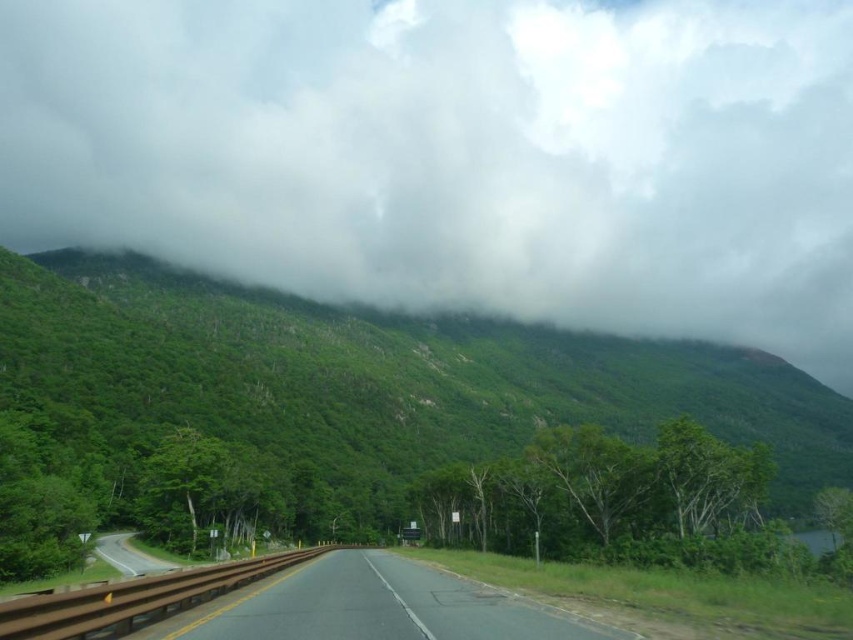
You are a driver approaching the asphalt road at lower left and want to park your car. The parking space you want to enter is next to the green leafy forest at upper center. Considering their widths, which area is wider?

The green leafy forest at upper center is wider than the asphalt road at lower left, so the parking space next to the green leafy forest at upper center has more width available.

You are a driver approaching the asphalt road at lower left and want to look up at the sky. Which direction should you turn your head to see the white fluffy cloud at upper center?

You should turn your head to the right to see the white fluffy cloud at upper center because it is located to the right of the asphalt road at lower left.

In the scene shown: You are standing at the side of the road and want to take a photo of the green leafy forest at upper center. If your camera has a maximum focusing distance of 80 meters, will it be able to focus on the forest?

The green leafy forest at upper center is 78.19 meters from the viewer, which is within the camera maximum focusing distance of 80 meters. Therefore, the camera can focus on the forest.